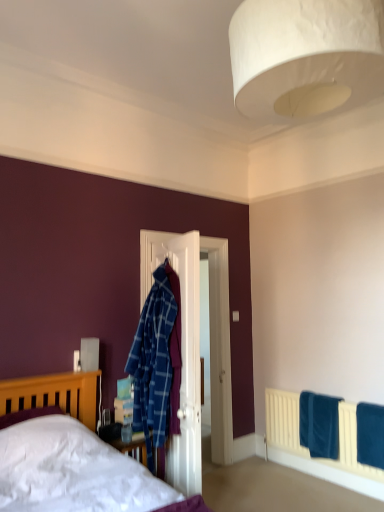
Measure the distance between point (4, 386) and camera.

Point (4, 386) is 2.64 meters from camera.

The image size is (384, 512). What do you see at coordinates (370, 434) in the screenshot?
I see `blue soft towel at lower right, the first bath towel when ordered from front to back` at bounding box center [370, 434].

The width and height of the screenshot is (384, 512). Identify the location of matte wooden bed at lower left. (71, 454).

Between blue soft towel at lower right, the first bath towel when ordered from front to back, and white wooden door at center, which one has smaller width?

white wooden door at center is thinner.

Locate an element on the screen. The width and height of the screenshot is (384, 512). bath towel that is the 1st one when counting downward from the white wooden door at center (from the image's perspective) is located at coordinates (370, 434).

Between blue soft towel at lower right, the first bath towel when ordered from front to back, and white wooden door at center, which one has smaller size?

blue soft towel at lower right, the first bath towel when ordered from front to back.

Who is shorter, matte wooden bed at lower left or white wooden door at center?

With less height is matte wooden bed at lower left.

Consider the image. Is matte wooden bed at lower left beside white wooden door at center?

matte wooden bed at lower left and white wooden door at center are not in contact.

Which of these two, matte wooden bed at lower left or white wooden door at center, is thinner?

white wooden door at center.

Considering the positions of objects white paper lampshade at upper center and blue soft towel at lower right, which is the second bath towel in back-to-front order, in the image provided, who is in front, white paper lampshade at upper center or blue soft towel at lower right, which is the second bath towel in back-to-front order,?

white paper lampshade at upper center is closer to the camera.

Could you tell me if white paper lampshade at upper center is facing blue soft towel at lower right, which is the second bath towel in back-to-front order?

No, white paper lampshade at upper center is not turned towards blue soft towel at lower right, which is the second bath towel in back-to-front order.

Which is farther from the camera, (283,104) or (365,403)?

The point (365,403) is behind.

Is white paper lampshade at upper center taller than blue soft towel at lower right, the first bath towel from the right?

Indeed, white paper lampshade at upper center has a greater height compared to blue soft towel at lower right, the first bath towel from the right.

At what (x,y) coordinates should I click in order to perform the action: click on bed in front of the white paper lampshade at upper center. Please return your answer as a coordinate pair (x, y). Looking at the image, I should click on (71, 454).

Consider the image. Are white paper lampshade at upper center and matte wooden bed at lower left far apart?

Yes, white paper lampshade at upper center and matte wooden bed at lower left are quite far apart.

Can you confirm if white paper lampshade at upper center is taller than matte wooden bed at lower left?

Incorrect, the height of white paper lampshade at upper center is not larger of that of matte wooden bed at lower left.

Which of these two, blue soft towel at lower right, the second bath towel in the left-to-right sequence, or white paper lampshade at upper center, is thinner?

With smaller width is blue soft towel at lower right, the second bath towel in the left-to-right sequence.

From the image's perspective, between blue soft towel at lower right, which is the second bath towel in back-to-front order, and white paper lampshade at upper center, who is located below?

blue soft towel at lower right, which is the second bath towel in back-to-front order.

Considering the sizes of objects blue soft towel at lower right, the first bath towel when ordered from front to back, and white paper lampshade at upper center in the image provided, who is shorter, blue soft towel at lower right, the first bath towel when ordered from front to back, or white paper lampshade at upper center?

Standing shorter between the two is blue soft towel at lower right, the first bath towel when ordered from front to back.

Who is more distant, blue soft towel at lower right, the first bath towel when ordered from front to back, or white paper lampshade at upper center?

blue soft towel at lower right, the first bath towel when ordered from front to back, is behind.

Which of these two, blue soft towel at lower right, the first bath towel when ordered from front to back, or blue soft towel at lower right, acting as the first bath towel starting from the left, stands shorter?

blue soft towel at lower right, acting as the first bath towel starting from the left, is shorter.

Which of these two, blue soft towel at lower right, which is the second bath towel in back-to-front order, or blue soft towel at lower right, which appears as the 1th bath towel when viewed from the back, is thinner?

blue soft towel at lower right, which appears as the 1th bath towel when viewed from the back, is thinner.

Could you measure the distance between blue soft towel at lower right, the second bath towel in the left-to-right sequence, and blue soft towel at lower right, acting as the first bath towel starting from the left?

The distance of blue soft towel at lower right, the second bath towel in the left-to-right sequence, from blue soft towel at lower right, acting as the first bath towel starting from the left, is 12.25 inches.

How many degrees apart are the facing directions of blue soft towel at lower right, the second bath towel in the left-to-right sequence, and blue soft towel at lower right, the second bath towel viewed from the front?

They differ by 0.00402 degrees in their facing directions.

From the image's perspective, which is below, blue soft towel at lower right, the second bath towel viewed from the front, or white paper lampshade at upper center?

blue soft towel at lower right, the second bath towel viewed from the front, from the image's perspective.

Does blue soft towel at lower right, which appears as the 1th bath towel when viewed from the back, have a larger size compared to white paper lampshade at upper center?

No, blue soft towel at lower right, which appears as the 1th bath towel when viewed from the back, is not bigger than white paper lampshade at upper center.

From a real-world perspective, is blue soft towel at lower right, which is the second bath towel in right-to-left order, above or below white paper lampshade at upper center?

From a real-world perspective, blue soft towel at lower right, which is the second bath towel in right-to-left order, is physically below white paper lampshade at upper center.

The width and height of the screenshot is (384, 512). I want to click on lamp above the blue soft towel at lower right, which is the second bath towel in right-to-left order (from a real-world perspective), so click(305, 55).

This screenshot has width=384, height=512. Identify the location of bath towel in front of the white wooden door at center. (370, 434).

I want to click on bed beneath the white wooden door at center (from a real-world perspective), so click(x=71, y=454).

Looking at the image, which one is located closer to white paper lampshade at upper center, white wooden door at center or matte wooden bed at lower left?

white wooden door at center is positioned closer to the anchor white paper lampshade at upper center.

Estimate the real-world distances between objects in this image. Which object is further from matte wooden bed at lower left, white wooden door at center or blue soft towel at lower right, acting as the first bath towel starting from the left?

blue soft towel at lower right, acting as the first bath towel starting from the left, is further to matte wooden bed at lower left.

Which object lies nearer to the anchor point white paper lampshade at upper center, white wooden door at center or blue soft towel at lower right, the first bath towel from the right?

Among the two, white wooden door at center is located nearer to white paper lampshade at upper center.

When comparing their distances from blue soft towel at lower right, acting as the first bath towel starting from the left, does blue soft towel at lower right, the first bath towel when ordered from front to back, or matte wooden bed at lower left seem closer?

The object closer to blue soft towel at lower right, acting as the first bath towel starting from the left, is blue soft towel at lower right, the first bath towel when ordered from front to back.

From the image, which object appears to be nearer to white wooden door at center, white paper lampshade at upper center or blue soft towel at lower right, which appears as the 1th bath towel when viewed from the back?

The object closer to white wooden door at center is blue soft towel at lower right, which appears as the 1th bath towel when viewed from the back.

Based on their spatial positions, is blue soft towel at lower right, which is the second bath towel in back-to-front order, or blue soft towel at lower right, which is the second bath towel in right-to-left order, closer to matte wooden bed at lower left?

blue soft towel at lower right, which is the second bath towel in right-to-left order, is closer to matte wooden bed at lower left.

When comparing their distances from white wooden door at center, does matte wooden bed at lower left or blue soft towel at lower right, which is the second bath towel in back-to-front order, seem further?

blue soft towel at lower right, which is the second bath towel in back-to-front order, lies further to white wooden door at center than the other object.

From the picture: Considering their positions, is blue soft towel at lower right, which is the second bath towel in back-to-front order, positioned further to white wooden door at center than matte wooden bed at lower left?

blue soft towel at lower right, which is the second bath towel in back-to-front order, is positioned further to the anchor white wooden door at center.

I want to click on lamp between matte wooden bed at lower left and blue soft towel at lower right, the second bath towel viewed from the front, along the z-axis, so click(305, 55).

Identify the location of door between white paper lampshade at upper center and blue soft towel at lower right, which is the second bath towel in right-to-left order, from front to back. The height and width of the screenshot is (512, 384). tap(181, 350).

Where is `door between matte wooden bed at lower left and blue soft towel at lower right, which appears as the 1th bath towel when viewed from the back, along the z-axis`? This screenshot has width=384, height=512. door between matte wooden bed at lower left and blue soft towel at lower right, which appears as the 1th bath towel when viewed from the back, along the z-axis is located at coordinates (181, 350).

Locate an element on the screen. bath towel between white wooden door at center and blue soft towel at lower right, which is the second bath towel in back-to-front order, from left to right is located at coordinates (x=319, y=424).